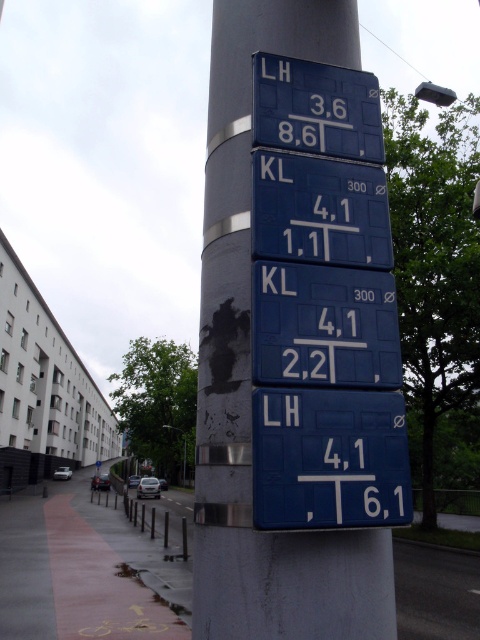
Does point (307, 470) lie in front of point (310, 115)?

Yes, point (307, 470) is in front of point (310, 115).

Based on the photo, does blue matte parking sign at lower center appear on the left side of blue matte sign at upper center?

Yes, blue matte parking sign at lower center is to the left of blue matte sign at upper center.

Which is in front, point (261, 490) or point (257, 93)?

Positioned in front is point (261, 490).

The height and width of the screenshot is (640, 480). I want to click on blue matte parking sign at lower center, so click(328, 460).

Is blue metal sign at center to the right of blue matte parking sign at lower center from the viewer's perspective?

In fact, blue metal sign at center is to the left of blue matte parking sign at lower center.

Consider the image. How far apart are blue metal sign at center and blue matte parking sign at lower center?

A distance of 10.94 inches exists between blue metal sign at center and blue matte parking sign at lower center.

Which is in front, point (199, 403) or point (338, 512)?

Point (338, 512)

Where is `blue metal sign at center`? This screenshot has width=480, height=640. blue metal sign at center is located at coordinates (250, 372).

Does blue matte sign at center appear on the left side of blue metallic sign at center?

No, blue matte sign at center is not to the left of blue metallic sign at center.

Who is positioned more to the left, blue matte sign at center or blue metallic sign at center?

Positioned to the left is blue metallic sign at center.

Image resolution: width=480 pixels, height=640 pixels. Describe the element at coordinates (324, 326) in the screenshot. I see `blue matte sign at center` at that location.

Find the location of `blue matte sign at center`. blue matte sign at center is located at coordinates (324, 326).